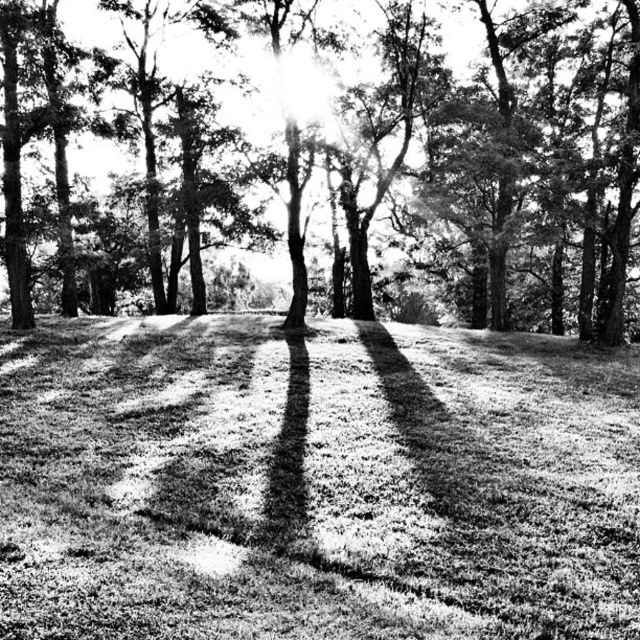
You are a hiker trying to determine the best path through the forest. You notice the grassy at center and the smooth bark tree at center. Which one is larger in size?

The smooth bark tree at center is larger than the grassy at center.

You are standing at the point marked by the coordinates point [314,483] in the forest scene. What type of terrain are you currently standing on?

The point [314,483] indicates grassy at center, so you are standing on grassy terrain.